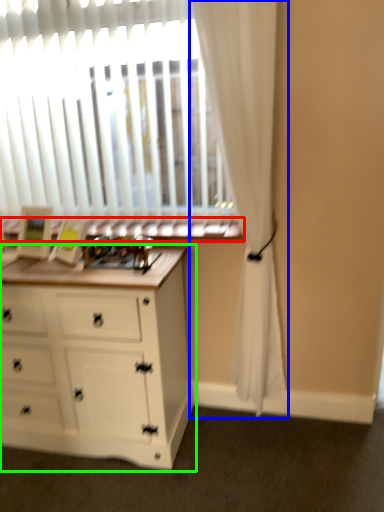
Question: Considering the real-world distances, which object is farthest from window sill (highlighted by a red box)? curtain (highlighted by a blue box) or chest of drawers (highlighted by a green box)?

Choices:
 (A) curtain
 (B) chest of drawers

Answer: (B)